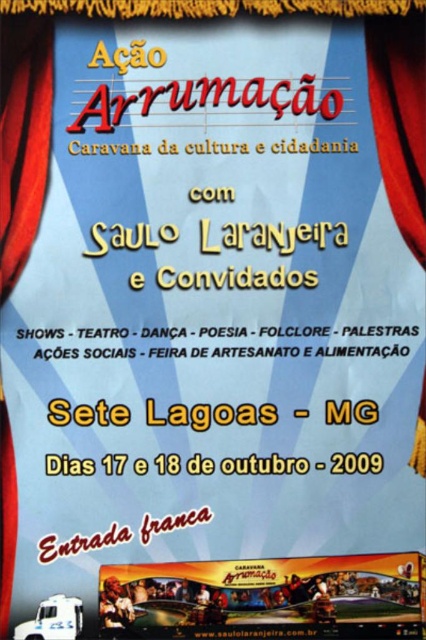
Question: Does yellow fabric banner at lower center appear over red velvet curtain at upper right?

Choices:
 (A) yes
 (B) no

Answer: (B)

Question: Based on their relative distances, which object is farther from the yellow fabric banner at lower center?

Choices:
 (A) red velvet curtain at upper right
 (B) red velvet curtain at left

Answer: (B)

Question: Can you confirm if yellow fabric banner at lower center is wider than red velvet curtain at left?

Choices:
 (A) yes
 (B) no

Answer: (A)

Question: Observing the image, what is the correct spatial positioning of red velvet curtain at left in reference to red velvet curtain at upper right?

Choices:
 (A) above
 (B) below

Answer: (B)

Question: Which point is farther to the camera?

Choices:
 (A) (16, 64)
 (B) (391, 557)
 (C) (391, 86)

Answer: (C)

Question: Which of these objects is positioned closest to the yellow fabric banner at lower center?

Choices:
 (A) red velvet curtain at upper right
 (B) red velvet curtain at left

Answer: (A)